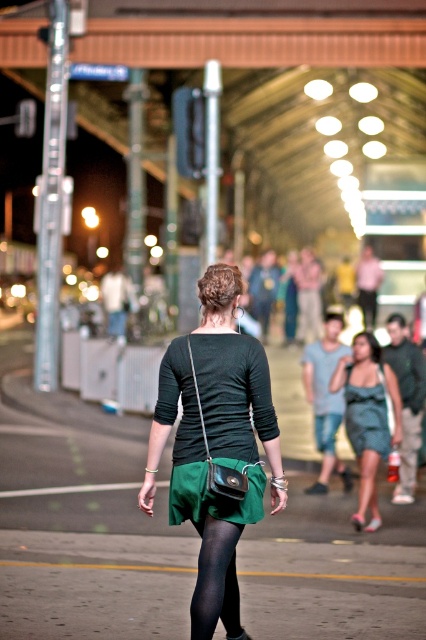
You are standing at the point marked as point (83, 520) in the image. What object is located exactly at this point?

The green fabric skirt at center is located exactly at point (83, 520).

You are a fashion designer observing the scene and notice two items of clothing in the foreground. The matte green skirt at center and the matte green dress at center. Which one is covering the other?

The matte green skirt at center is positioned over the matte green dress at center, so the skirt is covering the dress.

You are a fashion designer observing the scene and want to create a new outfit that combines the green fabric skirt at center and the black tights at center. Since the skirt is larger than the tights, how might you adjust the tights to ensure they complement the skirt effectively?

The green fabric skirt at center is bigger than the black tights at center. To ensure they complement each other, the tights could be designed with a slightly wider or more structured fit to balance the proportions with the larger skirt.